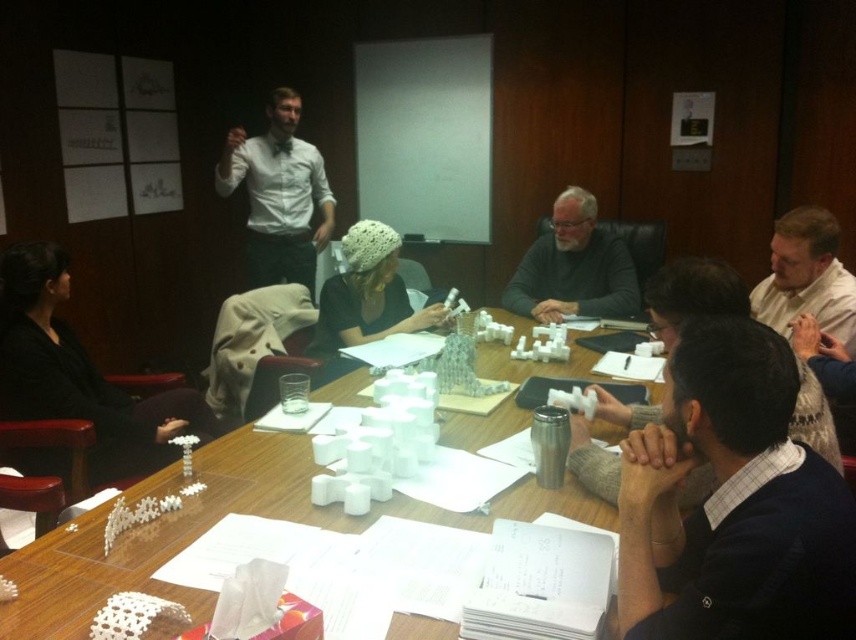
You are a participant in the conference room and notice two items at the center of the table. One is the gray matte sweater at center and the other is the white knitted hat at center. Which item is placed on top of the other?

The gray matte sweater at center is positioned over the white knitted hat at center, so the sweater is on top of the hat.

Based on the photo, you are standing at the position of the black fabric jacket at lower left and want to reach the glass of water on the table. The table is 2 meters long. Can you comfortably reach the glass of water without moving your position?

The distance between the black fabric jacket at lower left and the glass of water is 2.19 meters, which is slightly longer than the table length of 2 meters. Therefore, you cannot comfortably reach the glass of water without moving your position.

You are standing at point [266,449]. The nearest exit is 6.02 feet away from you. Can you reach the nearest exit within 3 seconds if you walk at a speed of 3 feet per second?

Yes, since you can cover 3 feet per second multiplied by 3 seconds equals 9 feet, which is more than the 6.02 feet distance to the nearest exit.